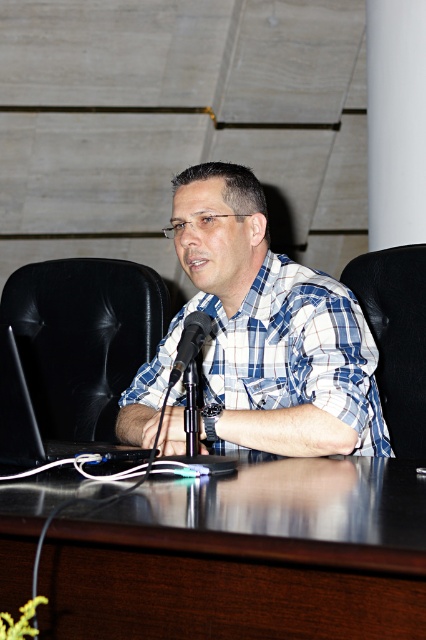
Question: Which point is farther to the camera?

Choices:
 (A) white smooth pillar at upper right
 (B) black leather chair at right

Answer: (A)

Question: From the image, what is the correct spatial relationship of dark wood table at center in relation to black matte laptop at center?

Choices:
 (A) above
 (B) below

Answer: (B)

Question: Which is farther from the black matte laptop at center?

Choices:
 (A) dark wood table at center
 (B) black metallic microphone at center

Answer: (A)

Question: Does dark wood table at center have a lesser width compared to black metallic microphone at center?

Choices:
 (A) yes
 (B) no

Answer: (B)

Question: Which of these objects is positioned closest to the black matte laptop at center?

Choices:
 (A) black metallic microphone at center
 (B) black leather chair at right
 (C) white smooth pillar at upper right

Answer: (A)

Question: Can you confirm if dark wood table at center is bigger than black leather chair at right?

Choices:
 (A) yes
 (B) no

Answer: (A)